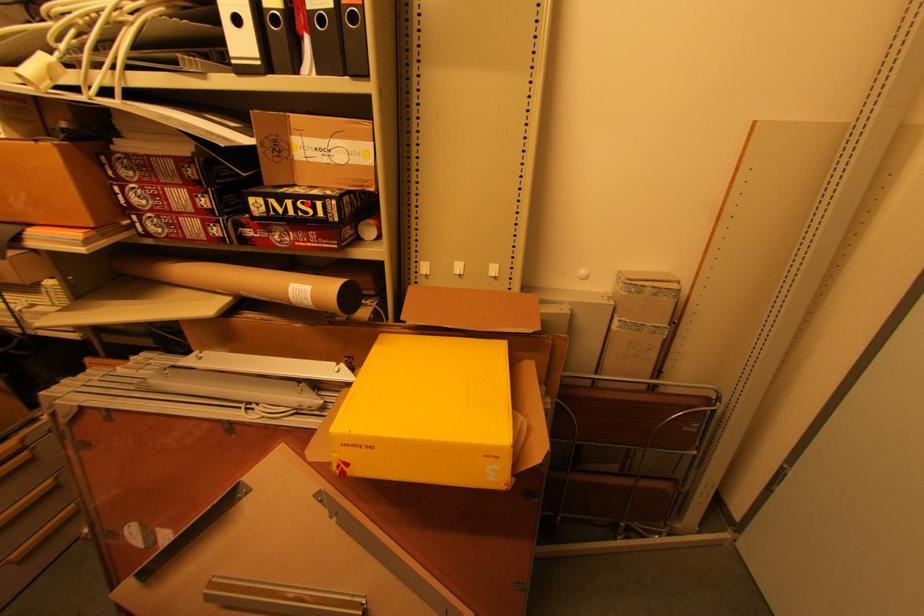
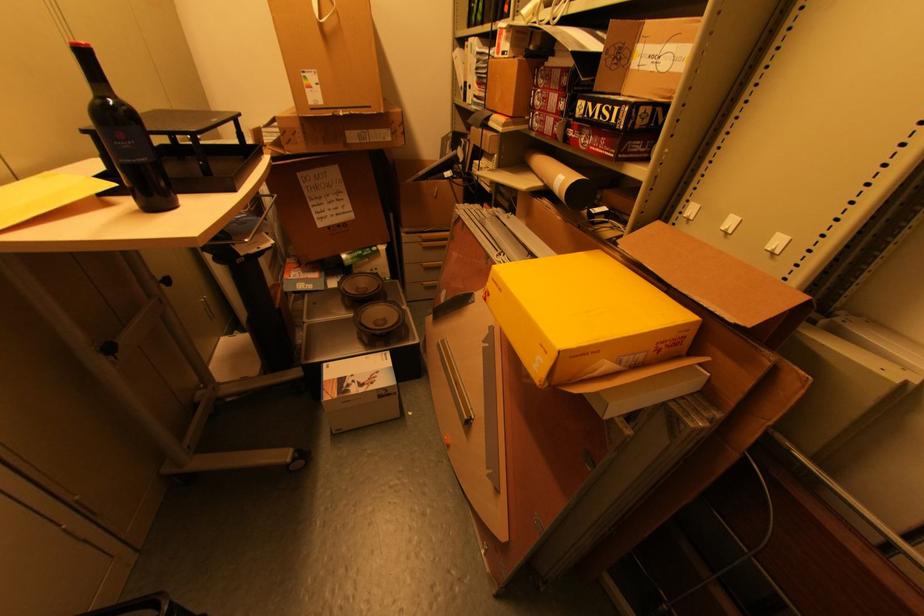
Where in the second image is the point corresponding to the highlighted location from the first image?

(610, 108)